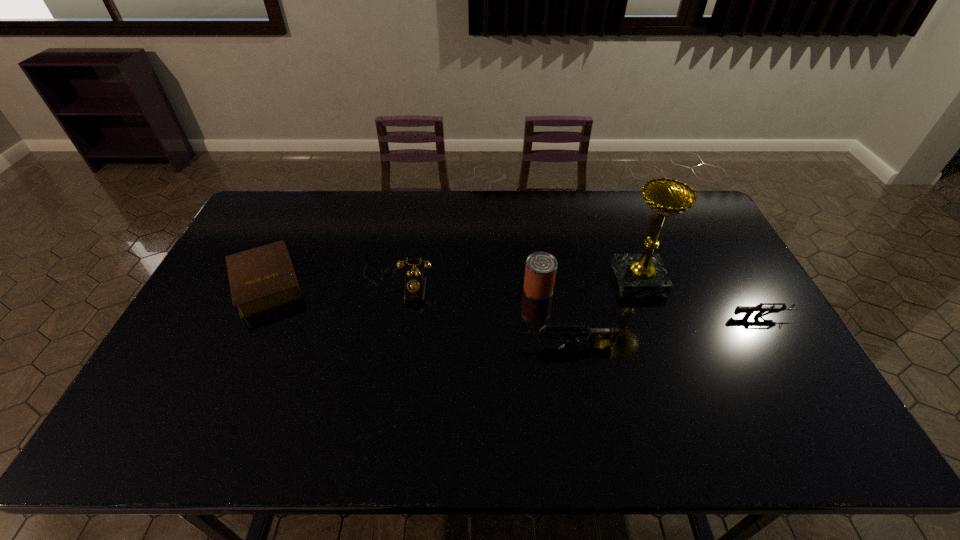
Where is `vacant area situated aimed along the barrel of the fourth tallest object`? vacant area situated aimed along the barrel of the fourth tallest object is located at coordinates [419, 344].

This screenshot has height=540, width=960. Find the location of `vacant space located 0.340m aimed along the barrel of the fourth tallest object`. vacant space located 0.340m aimed along the barrel of the fourth tallest object is located at coordinates (389, 344).

Where is `vacant region located 0.100m on the dial of the second object from left to right`? This screenshot has width=960, height=540. vacant region located 0.100m on the dial of the second object from left to right is located at coordinates (389, 329).

At what (x,y) coordinates should I click in order to perform the action: click on vacant region located 0.260m on the left of the can. Please return your answer as a coordinate pair (x, y). This screenshot has height=540, width=960. Looking at the image, I should click on (439, 289).

At what (x,y) coordinates should I click in order to perform the action: click on free space located 0.180m on the back of the Bible. Please return your answer as a coordinate pair (x, y). This screenshot has height=540, width=960. Looking at the image, I should click on (298, 219).

Locate an element on the screen. The width and height of the screenshot is (960, 540). vacant space located 0.250m on the front-facing side of the tallest object is located at coordinates (536, 280).

At what (x,y) coordinates should I click in order to perform the action: click on vacant space located on the front-facing side of the tallest object. Please return your answer as a coordinate pair (x, y). The height and width of the screenshot is (540, 960). Looking at the image, I should click on (593, 280).

The image size is (960, 540). I want to click on free space located on the front-facing side of the tallest object, so click(x=529, y=280).

Where is `object present at the left edge`? object present at the left edge is located at coordinates (263, 278).

This screenshot has height=540, width=960. What are the coordinates of `object at the right edge` in the screenshot? It's located at (749, 310).